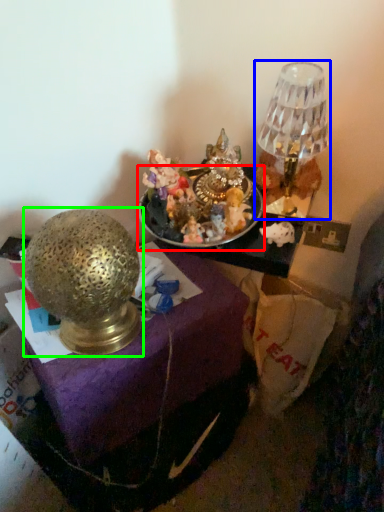
Question: Which is farther away from tableware (highlighted by a red box)? lamp (highlighted by a blue box) or lamp (highlighted by a green box)?

Choices:
 (A) lamp
 (B) lamp

Answer: (B)